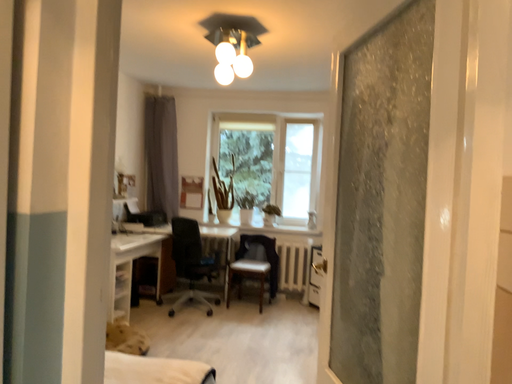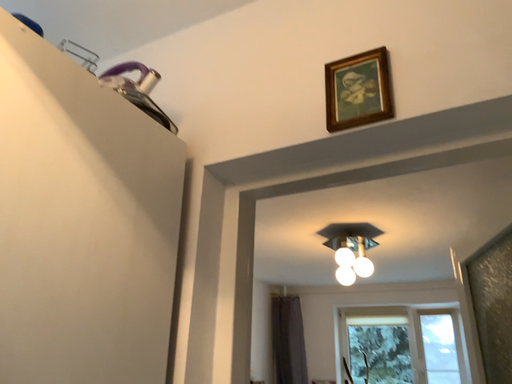
Question: How did the camera likely rotate when shooting the video?

Choices:
 (A) rotated upward
 (B) rotated downward

Answer: (A)